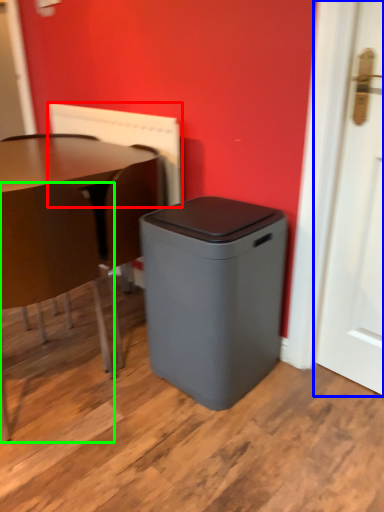
Question: Considering the real-world distances, which object is closest to radiator (highlighted by a red box)? door (highlighted by a blue box) or chair (highlighted by a green box).

Choices:
 (A) door
 (B) chair

Answer: (B)